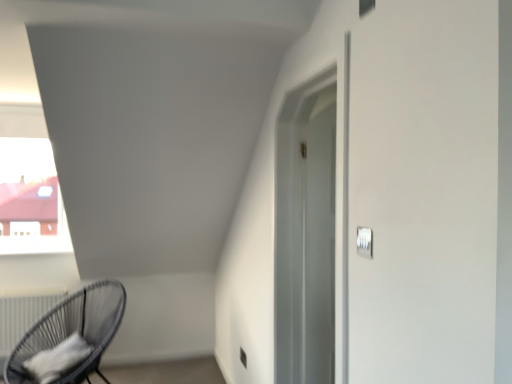
Question: Does point (22, 337) appear closer or farther from the camera than point (242, 355)?

Choices:
 (A) closer
 (B) farther

Answer: (A)

Question: Is black wicker chair at lower left spatially inside satin silver outlet at lower center, or outside of it?

Choices:
 (A) outside
 (B) inside

Answer: (A)

Question: Which is nearer to the black wicker chair at lower left?

Choices:
 (A) white matte radiator at lower left
 (B) white plastic light switch at upper right
 (C) satin silver outlet at lower center

Answer: (A)

Question: Estimate the real-world distances between objects in this image. Which object is farther from the black wicker chair at lower left?

Choices:
 (A) satin silver outlet at lower center
 (B) white matte radiator at lower left
 (C) white plastic light switch at upper right

Answer: (C)